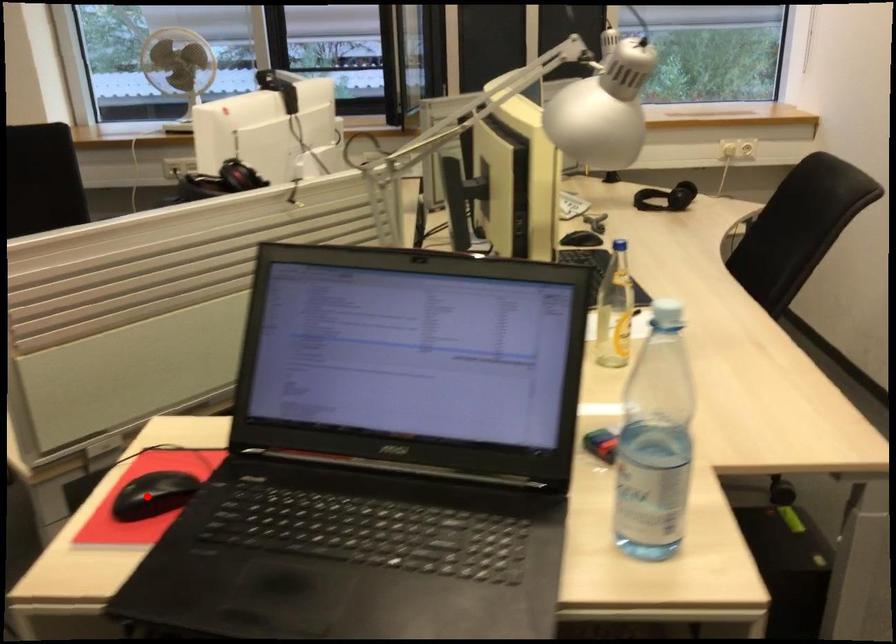
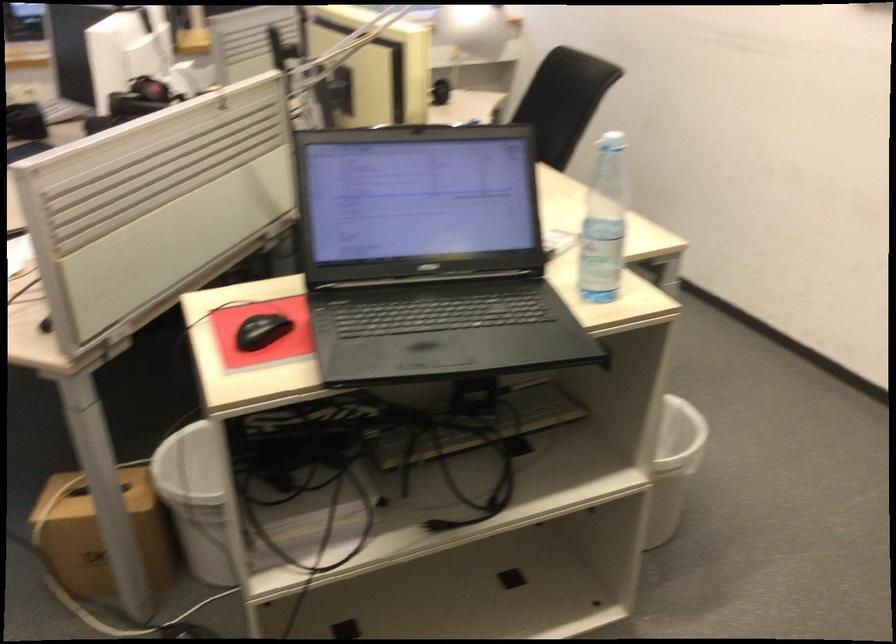
The point at the highlighted location is marked in the first image. Where is the corresponding point in the second image?

(261, 330)